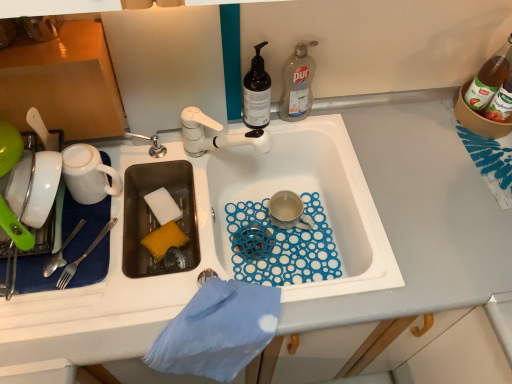
You are a GUI agent. You are given a task and a screenshot of the screen. Output one action in this format:
    pyautogui.click(x=<x>, y=<y>)
    Task: Click on the vacant location behind satin silver fork at left
    
    Given the screenshot: What is the action you would take?
    pyautogui.click(x=115, y=196)